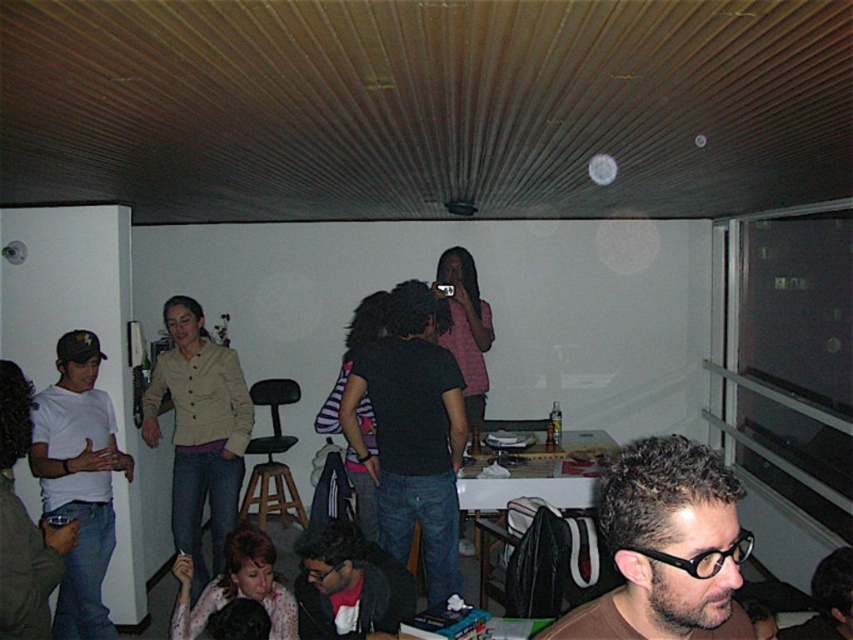
Is dark gray sweater at lower center further to the viewer compared to wooden bar stool at center?

That is False.

Does dark gray sweater at lower center appear on the right side of wooden bar stool at center?

Indeed, dark gray sweater at lower center is positioned on the right side of wooden bar stool at center.

What do you see at coordinates (349, 586) in the screenshot?
I see `dark gray sweater at lower center` at bounding box center [349, 586].

The height and width of the screenshot is (640, 853). What are the coordinates of `dark gray sweater at lower center` in the screenshot? It's located at (349, 586).

Is the position of white matte t-shirt at left less distant than that of brown leather glasses at lower right?

No, white matte t-shirt at left is further to the viewer.

Can you confirm if white matte t-shirt at left is shorter than brown leather glasses at lower right?

No.

Measure the distance between white matte t-shirt at left and camera.

white matte t-shirt at left is 3.26 meters away from camera.

Where is `white matte t-shirt at left`? The height and width of the screenshot is (640, 853). white matte t-shirt at left is located at coordinates (79, 481).

I want to click on white matte t-shirt at left, so click(x=79, y=481).

Is white matte t-shirt at left bigger than dark gray sweater at lower center?

Yes, white matte t-shirt at left is bigger than dark gray sweater at lower center.

Measure the distance between white matte t-shirt at left and camera.

3.26 meters

The width and height of the screenshot is (853, 640). What are the coordinates of `white matte t-shirt at left` in the screenshot? It's located at (79, 481).